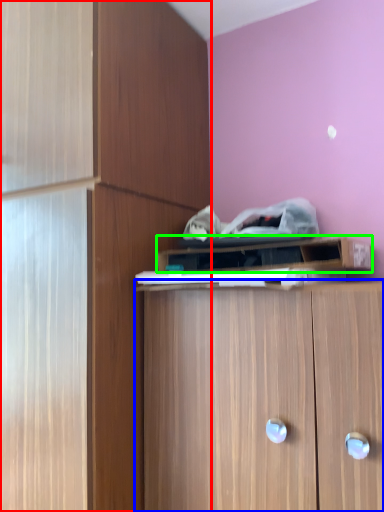
Question: Considering the real-world distances, which object is closest to cabinetry (highlighted by a red box)? cabinetry (highlighted by a blue box) or cabinetry (highlighted by a green box).

Choices:
 (A) cabinetry
 (B) cabinetry

Answer: (B)